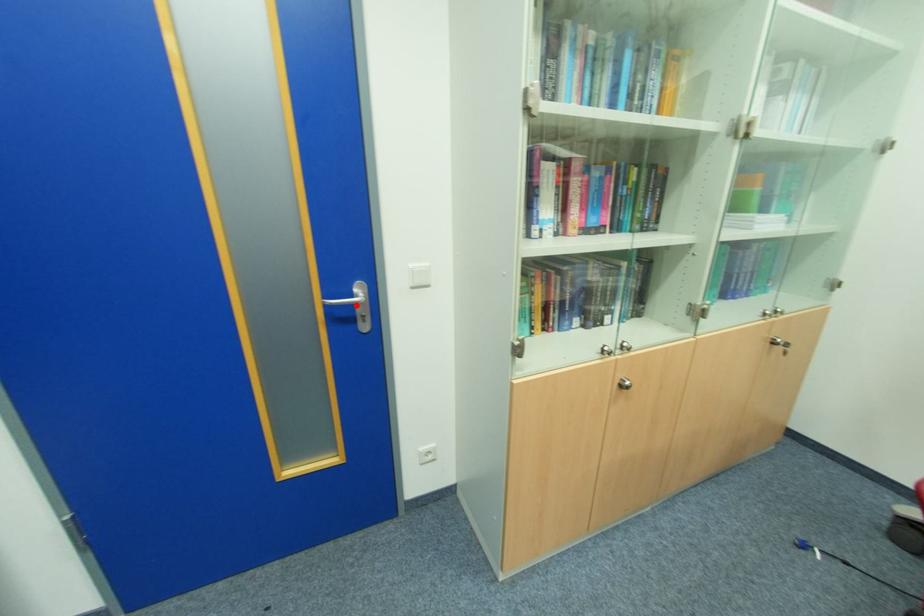
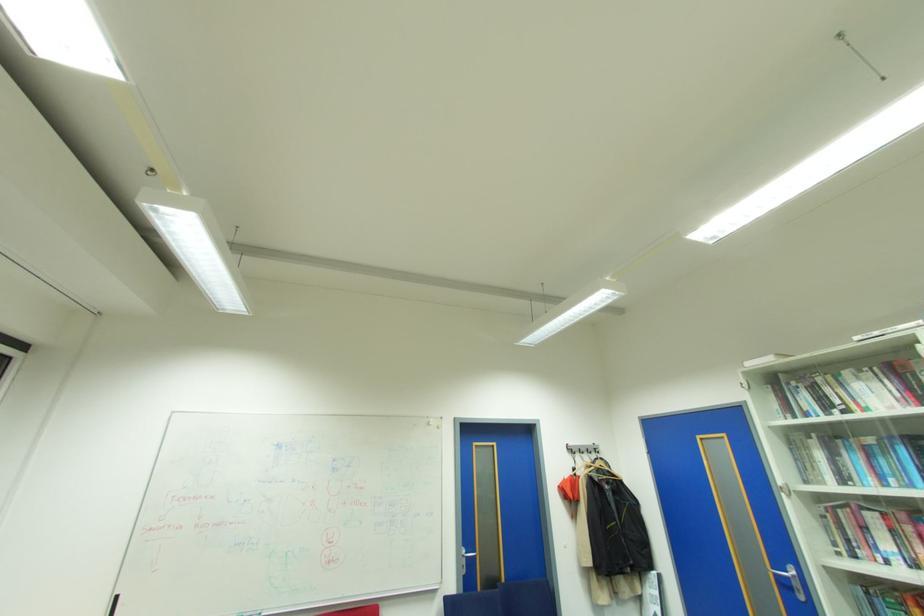
Question: I am providing you with two images of the same scene from different viewpoints. Given a red point in image1, look at the same physical point in image2. Is it:

Choices:
 (A) Closer to the viewpoint
 (B) Farther from the viewpoint

Answer: (A)